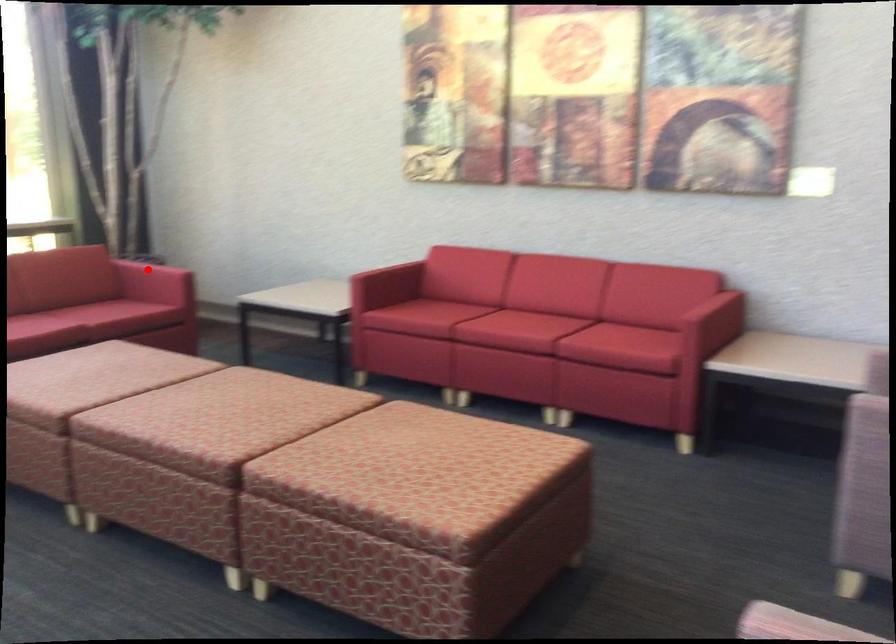
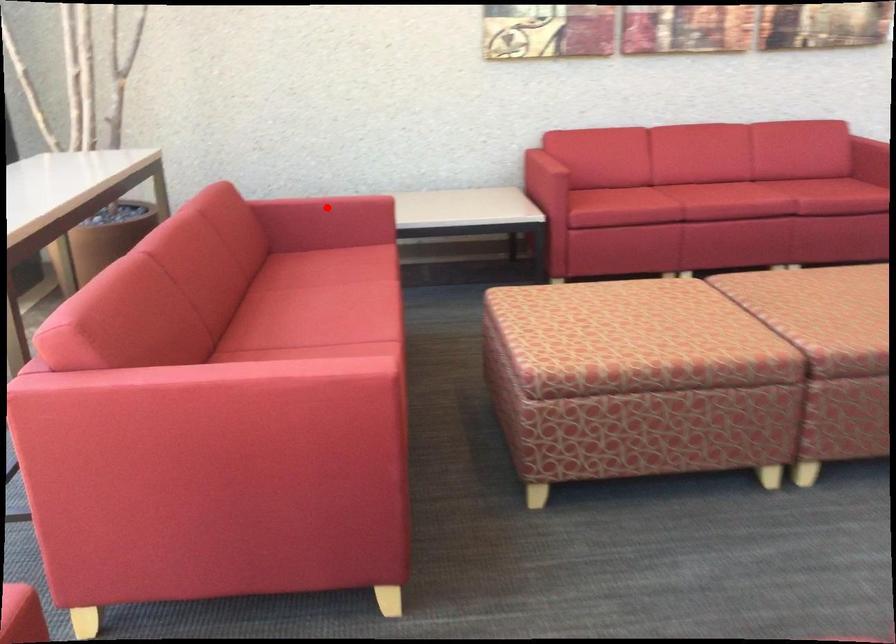
I am providing you with two images of the same scene from different viewpoints. A red point is marked on the first image and another point is marked on the second image. Is the red point in image1 aligned with the point shown in image2?

Yes